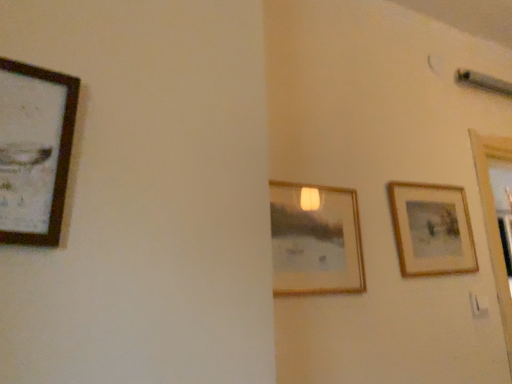
In order to click on wooden framed picture at right, positioned as the 3th picture frame in front-to-back order in this screenshot , I will do `click(432, 229)`.

Where is `wooden framed picture at center, positioned as the second picture frame in back-to-front order`? The image size is (512, 384). wooden framed picture at center, positioned as the second picture frame in back-to-front order is located at coordinates (315, 241).

What do you see at coordinates (315, 241) in the screenshot?
I see `wooden framed picture at center, positioned as the second picture frame in back-to-front order` at bounding box center [315, 241].

Locate an element on the screen. The width and height of the screenshot is (512, 384). wooden framed artwork at left, the 3th picture frame viewed from the back is located at coordinates (34, 151).

Considering their positions, is wooden framed picture at right, positioned as the third picture frame in left-to-right order, located in front of or behind wooden framed artwork at left, acting as the 1th picture frame starting from the front?

wooden framed picture at right, positioned as the third picture frame in left-to-right order, is positioned farther from the viewer than wooden framed artwork at left, acting as the 1th picture frame starting from the front.

Does wooden framed picture at right, which appears as the first picture frame when viewed from the right, have a lesser height compared to wooden framed artwork at left, the 3th picture frame viewed from the back?

Incorrect, the height of wooden framed picture at right, which appears as the first picture frame when viewed from the right, does not fall short of that of wooden framed artwork at left, the 3th picture frame viewed from the back.

Who is bigger, wooden framed picture at right, acting as the 1th picture frame starting from the back, or wooden framed artwork at left, which is counted as the 3th picture frame, starting from the right?

wooden framed artwork at left, which is counted as the 3th picture frame, starting from the right, is bigger.

Is wooden framed picture at center, acting as the second picture frame starting from the left, closer to the viewer compared to wooden framed picture at right, positioned as the 3th picture frame in front-to-back order?

Yes, it is.

Is wooden framed picture at center, arranged as the 2th picture frame when viewed from the right, positioned with its back to wooden framed picture at right, acting as the 1th picture frame starting from the back?

No, wooden framed picture at center, arranged as the 2th picture frame when viewed from the right,'s orientation is not away from wooden framed picture at right, acting as the 1th picture frame starting from the back.

Between wooden framed picture at center, acting as the second picture frame starting from the left, and wooden framed picture at right, positioned as the 3th picture frame in front-to-back order, which one appears on the right side from the viewer's perspective?

wooden framed picture at right, positioned as the 3th picture frame in front-to-back order, is more to the right.

Looking at this image, relative to wooden framed artwork at left, the 3th picture frame viewed from the back, is wooden framed picture at center, arranged as the second picture frame when viewed from the front, in front or behind?

wooden framed picture at center, arranged as the second picture frame when viewed from the front, is positioned farther from the viewer than wooden framed artwork at left, the 3th picture frame viewed from the back.

Can you confirm if wooden framed picture at center, arranged as the 2th picture frame when viewed from the right, is smaller than wooden framed artwork at left, acting as the 1th picture frame starting from the left?

Yes, wooden framed picture at center, arranged as the 2th picture frame when viewed from the right, is smaller than wooden framed artwork at left, acting as the 1th picture frame starting from the left.

Looking at this image, is wooden framed picture at center, arranged as the 2th picture frame when viewed from the right, at the left side of wooden framed artwork at left, acting as the 1th picture frame starting from the left?

Incorrect, wooden framed picture at center, arranged as the 2th picture frame when viewed from the right, is not on the left side of wooden framed artwork at left, acting as the 1th picture frame starting from the left.

Is wooden framed picture at center, arranged as the second picture frame when viewed from the front, next to wooden framed artwork at left, which is counted as the 3th picture frame, starting from the right?

No, wooden framed picture at center, arranged as the second picture frame when viewed from the front, is not with wooden framed artwork at left, which is counted as the 3th picture frame, starting from the right.

How far apart are wooden framed artwork at left, the 3th picture frame viewed from the back, and wooden framed picture at center, arranged as the second picture frame when viewed from the front?

wooden framed artwork at left, the 3th picture frame viewed from the back, and wooden framed picture at center, arranged as the second picture frame when viewed from the front, are 25.43 inches apart from each other.

Is wooden framed artwork at left, acting as the 1th picture frame starting from the left, facing towards wooden framed picture at center, arranged as the 2th picture frame when viewed from the right?

No, wooden framed artwork at left, acting as the 1th picture frame starting from the left, is not facing towards wooden framed picture at center, arranged as the 2th picture frame when viewed from the right.

From the image's perspective, is wooden framed artwork at left, acting as the 1th picture frame starting from the left, located above or below wooden framed picture at center, arranged as the 2th picture frame when viewed from the right?

Clearly, from the image's perspective, wooden framed artwork at left, acting as the 1th picture frame starting from the left, is above wooden framed picture at center, arranged as the 2th picture frame when viewed from the right.

In terms of height, does wooden framed artwork at left, acting as the 1th picture frame starting from the left, look taller or shorter compared to wooden framed picture at center, arranged as the second picture frame when viewed from the front?

Considering their sizes, wooden framed artwork at left, acting as the 1th picture frame starting from the left, has less height than wooden framed picture at center, arranged as the second picture frame when viewed from the front.

Where is `picture frame that is the 1st one above the wooden framed picture at center, positioned as the second picture frame in back-to-front order (from a real-world perspective)`? The width and height of the screenshot is (512, 384). picture frame that is the 1st one above the wooden framed picture at center, positioned as the second picture frame in back-to-front order (from a real-world perspective) is located at coordinates (432, 229).

From a real-world perspective, is wooden framed picture at right, positioned as the 3th picture frame in front-to-back order, positioned under wooden framed picture at center, arranged as the second picture frame when viewed from the front, based on gravity?

Incorrect, from a real-world perspective, wooden framed picture at right, positioned as the 3th picture frame in front-to-back order, is higher than wooden framed picture at center, arranged as the second picture frame when viewed from the front.

Which of these two, wooden framed picture at right, acting as the 1th picture frame starting from the back, or wooden framed picture at center, acting as the second picture frame starting from the left, stands shorter?

wooden framed picture at center, acting as the second picture frame starting from the left.

Is wooden framed picture at right, positioned as the 3th picture frame in front-to-back order, to the left of wooden framed picture at center, acting as the second picture frame starting from the left, from the viewer's perspective?

No.

From the image's perspective, which is below, wooden framed artwork at left, which is counted as the 3th picture frame, starting from the right, or wooden framed picture at right, acting as the 1th picture frame starting from the back?

From the image's view, wooden framed picture at right, acting as the 1th picture frame starting from the back, is below.

Is the depth of wooden framed artwork at left, the 3th picture frame viewed from the back, greater than that of wooden framed picture at right, which appears as the first picture frame when viewed from the right?

No, it is in front of wooden framed picture at right, which appears as the first picture frame when viewed from the right.

From their relative heights in the image, would you say wooden framed artwork at left, which is counted as the 3th picture frame, starting from the right, is taller or shorter than wooden framed picture at right, acting as the 1th picture frame starting from the back?

In the image, wooden framed artwork at left, which is counted as the 3th picture frame, starting from the right, appears to be shorter than wooden framed picture at right, acting as the 1th picture frame starting from the back.

From the picture: Is wooden framed artwork at left, acting as the 1th picture frame starting from the front, not close to wooden framed picture at right, acting as the 1th picture frame starting from the back?

That's right, there is a large distance between wooden framed artwork at left, acting as the 1th picture frame starting from the front, and wooden framed picture at right, acting as the 1th picture frame starting from the back.

The width and height of the screenshot is (512, 384). Find the location of `picture frame that is the 1st one below the wooden framed artwork at left, which is counted as the 3th picture frame, starting from the right (from a real-world perspective)`. picture frame that is the 1st one below the wooden framed artwork at left, which is counted as the 3th picture frame, starting from the right (from a real-world perspective) is located at coordinates pos(432,229).

From the image's perspective, which picture frame is the 1st one above the wooden framed picture at center, arranged as the second picture frame when viewed from the front? Please provide its 2D coordinates.

[(432, 229)]

Which object lies nearer to the anchor point wooden framed picture at center, arranged as the 2th picture frame when viewed from the right, wooden framed artwork at left, acting as the 1th picture frame starting from the front, or wooden framed picture at right, positioned as the third picture frame in left-to-right order?

wooden framed picture at right, positioned as the third picture frame in left-to-right order, is positioned closer to the anchor wooden framed picture at center, arranged as the 2th picture frame when viewed from the right.

Considering their positions, is wooden framed picture at center, arranged as the second picture frame when viewed from the front, positioned closer to wooden framed artwork at left, the 3th picture frame viewed from the back, than wooden framed picture at right, positioned as the 3th picture frame in front-to-back order?

wooden framed picture at center, arranged as the second picture frame when viewed from the front.

Estimate the real-world distances between objects in this image. Which object is further from wooden framed picture at right, acting as the 1th picture frame starting from the back, wooden framed artwork at left, which is counted as the 3th picture frame, starting from the right, or wooden framed picture at center, acting as the second picture frame starting from the left?

wooden framed artwork at left, which is counted as the 3th picture frame, starting from the right, is further to wooden framed picture at right, acting as the 1th picture frame starting from the back.

Based on their spatial positions, is wooden framed picture at right, positioned as the 3th picture frame in front-to-back order, or wooden framed artwork at left, which is counted as the 3th picture frame, starting from the right, closer to wooden framed picture at center, arranged as the 2th picture frame when viewed from the right?

wooden framed picture at right, positioned as the 3th picture frame in front-to-back order.

From the image, which object appears to be nearer to wooden framed picture at right, positioned as the 3th picture frame in front-to-back order, wooden framed picture at center, acting as the second picture frame starting from the left, or wooden framed artwork at left, which is counted as the 3th picture frame, starting from the right?

wooden framed picture at center, acting as the second picture frame starting from the left, lies closer to wooden framed picture at right, positioned as the 3th picture frame in front-to-back order, than the other object.

Looking at the image, which one is located further to wooden framed artwork at left, which is counted as the 3th picture frame, starting from the right, wooden framed picture at right, which appears as the first picture frame when viewed from the right, or wooden framed picture at center, arranged as the second picture frame when viewed from the front?

Among the two, wooden framed picture at right, which appears as the first picture frame when viewed from the right, is located further to wooden framed artwork at left, which is counted as the 3th picture frame, starting from the right.

Identify the location of picture frame situated between wooden framed artwork at left, acting as the 1th picture frame starting from the front, and wooden framed picture at right, positioned as the third picture frame in left-to-right order, from left to right. Image resolution: width=512 pixels, height=384 pixels. (315, 241).